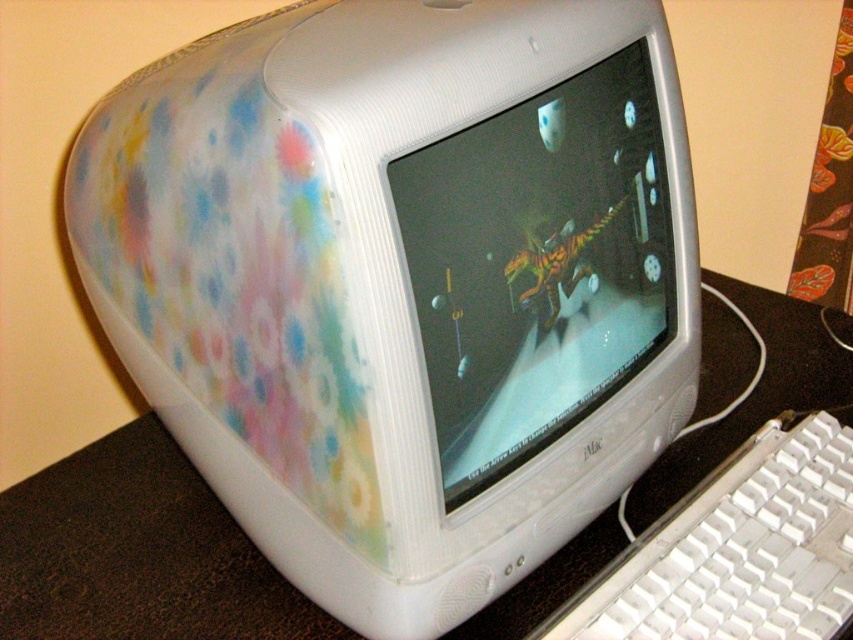
Question: Which of the following is the farthest from the observer?

Choices:
 (A) white plastic keyboard at lower right
 (B) white glossy monitor at center
 (C) white plastic computer desk at center

Answer: (C)

Question: Which point is farther to the camera?

Choices:
 (A) white plastic keyboard at lower right
 (B) white glossy monitor at center
 (C) white plastic computer desk at center

Answer: (C)

Question: Does white glossy monitor at center have a greater width compared to white plastic keyboard at lower right?

Choices:
 (A) no
 (B) yes

Answer: (A)

Question: Considering the relative positions of white plastic computer desk at center and white plastic keyboard at lower right in the image provided, where is white plastic computer desk at center located with respect to white plastic keyboard at lower right?

Choices:
 (A) left
 (B) right

Answer: (A)

Question: Among these objects, which one is nearest to the camera?

Choices:
 (A) white plastic keyboard at lower right
 (B) white plastic computer desk at center
 (C) white glossy monitor at center

Answer: (C)

Question: Does white glossy monitor at center come in front of white plastic keyboard at lower right?

Choices:
 (A) yes
 (B) no

Answer: (A)